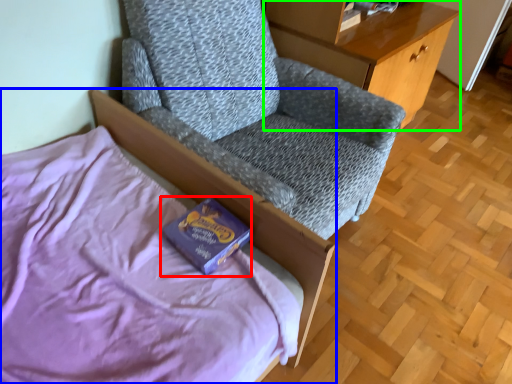
Question: Considering the real-world distances, which object is closest to paperback book (highlighted by a red box)? bed (highlighted by a blue box) or desk (highlighted by a green box).

Choices:
 (A) bed
 (B) desk

Answer: (A)